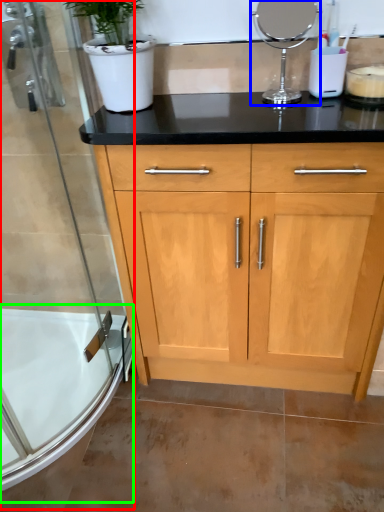
Question: Which object is the closest to the shower door (highlighted by a red box)? Choose among these: appliance (highlighted by a blue box) or bath (highlighted by a green box).

Choices:
 (A) appliance
 (B) bath

Answer: (B)